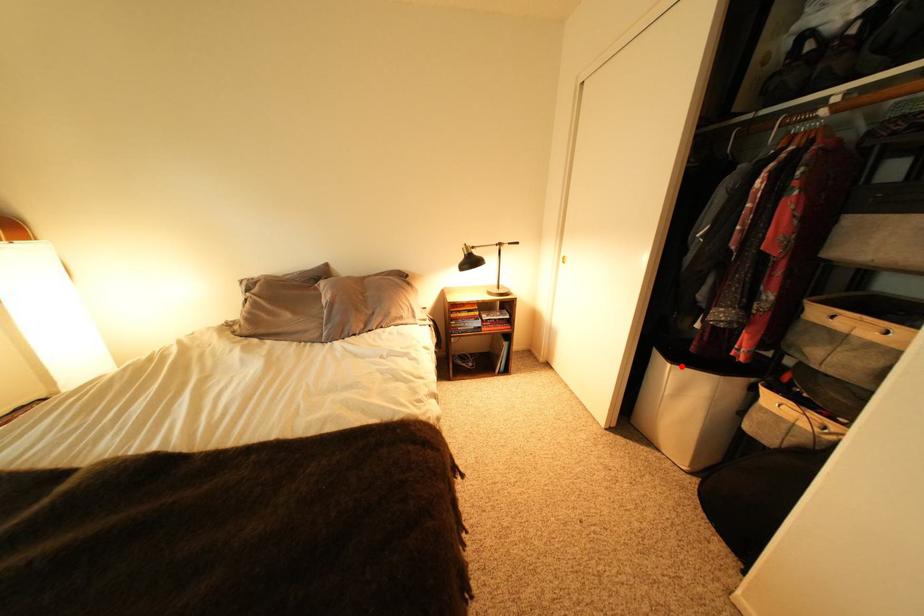
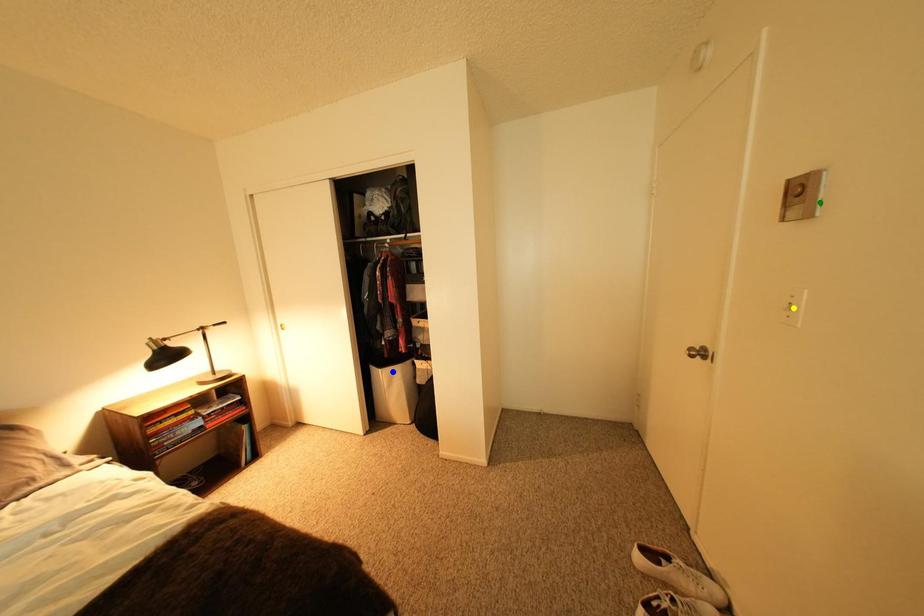
Question: I am providing you with two images of the same scene from different viewpoints. A red point is marked on the first image. You are given multiple points on the second image. In image 2, which mark is for the same physical point as the one in image 1?

Choices:
 (A) green point
 (B) blue point
 (C) yellow point

Answer: (B)